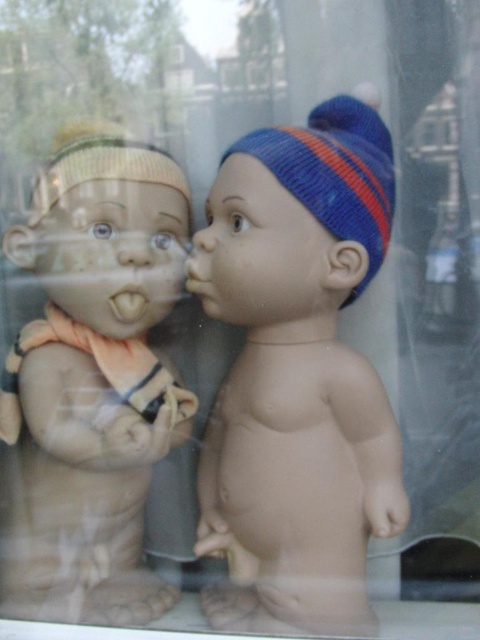
Between matte plastic baby at center and matte plastic nose at center, which one has more height?

With more height is matte plastic baby at center.

Is point (241, 144) more distant than point (199, 241)?

Yes.

Does point (216, 538) lie in front of point (214, 225)?

No, it is behind (214, 225).

Image resolution: width=480 pixels, height=640 pixels. In order to click on matte plastic baby at center in this screenshot , I will do `click(299, 371)`.

Can you confirm if matte porcelain doll at left is thinner than knitted blue and orange hat at center?

Incorrect, matte porcelain doll at left's width is not less than knitted blue and orange hat at center's.

Is matte porcelain doll at left wider than knitted blue and orange hat at center?

Indeed, matte porcelain doll at left has a greater width compared to knitted blue and orange hat at center.

Locate an element on the screen. This screenshot has height=640, width=480. matte porcelain doll at left is located at coordinates tap(93, 380).

Can you confirm if smooth beige nose at center is positioned below matte plastic nose at center?

Indeed, smooth beige nose at center is positioned under matte plastic nose at center.

Is point (152, 260) farther from camera compared to point (216, 243)?

Yes, point (152, 260) is farther from viewer.

The image size is (480, 640). What are the coordinates of `smooth beige nose at center` in the screenshot? It's located at (132, 248).